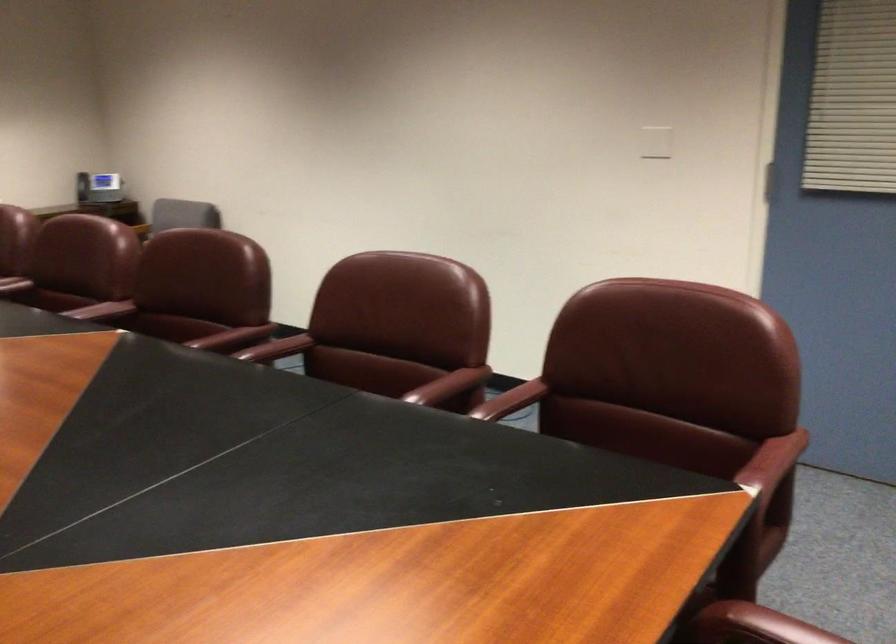
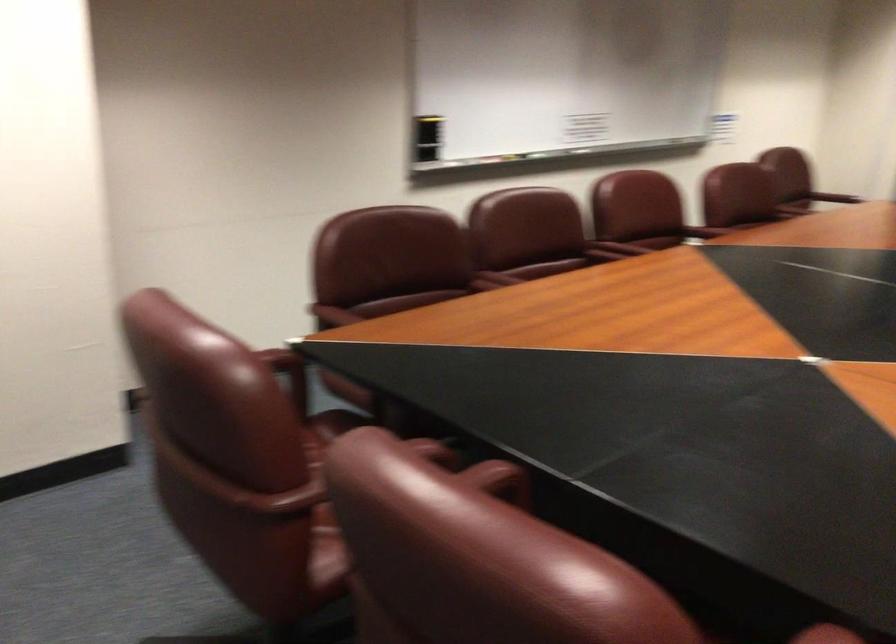
In the second image, find the point that corresponds to pixel 503 402 in the first image.

(433, 450)